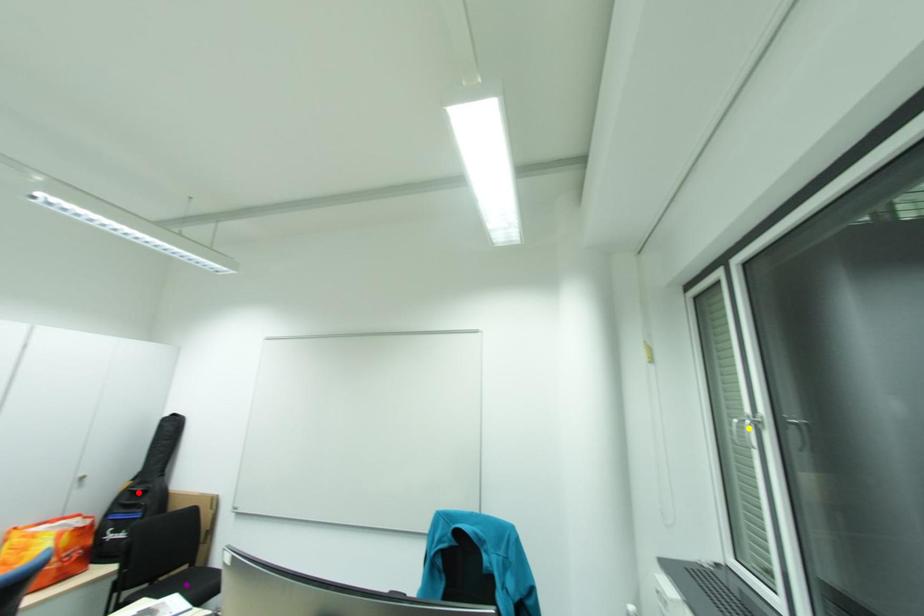
In the scene shown: Order these from nearest to farthest:
- yellow point
- purple point
- red point

red point
yellow point
purple point